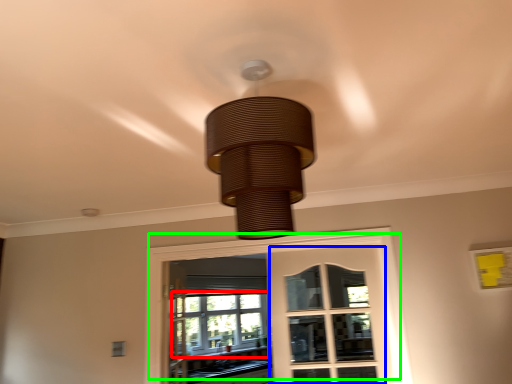
Question: Considering the real-world distances, which object is farthest from bay window (highlighted by a red box)? screen door (highlighted by a blue box) or window (highlighted by a green box)?

Choices:
 (A) screen door
 (B) window

Answer: (B)